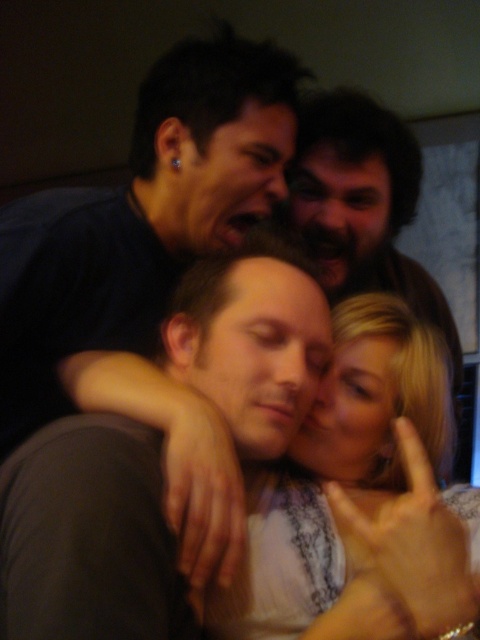
Can you confirm if matte black shirt at upper left is positioned above blonde hair at center?

Correct, matte black shirt at upper left is located above blonde hair at center.

You are a GUI agent. You are given a task and a screenshot of the screen. Output one action in this format:
    pyautogui.click(x=<x>, y=<y>)
    Task: Click on the matte black shirt at upper left
    Image resolution: width=480 pixels, height=640 pixels.
    Given the screenshot: What is the action you would take?
    pyautogui.click(x=141, y=218)

Between blonde hair at center and bearded man at upper center, which one is positioned higher?

bearded man at upper center is higher up.

At what (x,y) coordinates should I click in order to perform the action: click on blonde hair at center. Please return your answer as a coordinate pair (x, y). Looking at the image, I should click on (336, 468).

Locate an element on the screen. Image resolution: width=480 pixels, height=640 pixels. blonde hair at center is located at coordinates (336, 468).

Is matte black shirt at upper left smaller than bearded man at upper center?

Indeed, matte black shirt at upper left has a smaller size compared to bearded man at upper center.

From the picture: Between matte black shirt at upper left and bearded man at upper center, which one is positioned lower?

matte black shirt at upper left is below.

Who is more forward, [186,212] or [397,154]?

Positioned in front is point [186,212].

Where is `matte black shirt at upper left`? This screenshot has width=480, height=640. matte black shirt at upper left is located at coordinates (141, 218).